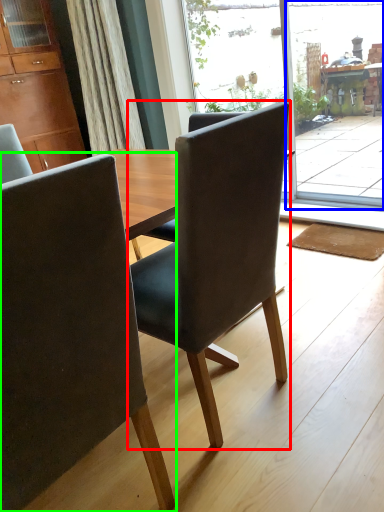
Question: Based on their relative distances, which object is nearer to chair (highlighted by a red box)? Choose from screen door (highlighted by a blue box) and chair (highlighted by a green box).

Choices:
 (A) screen door
 (B) chair

Answer: (B)